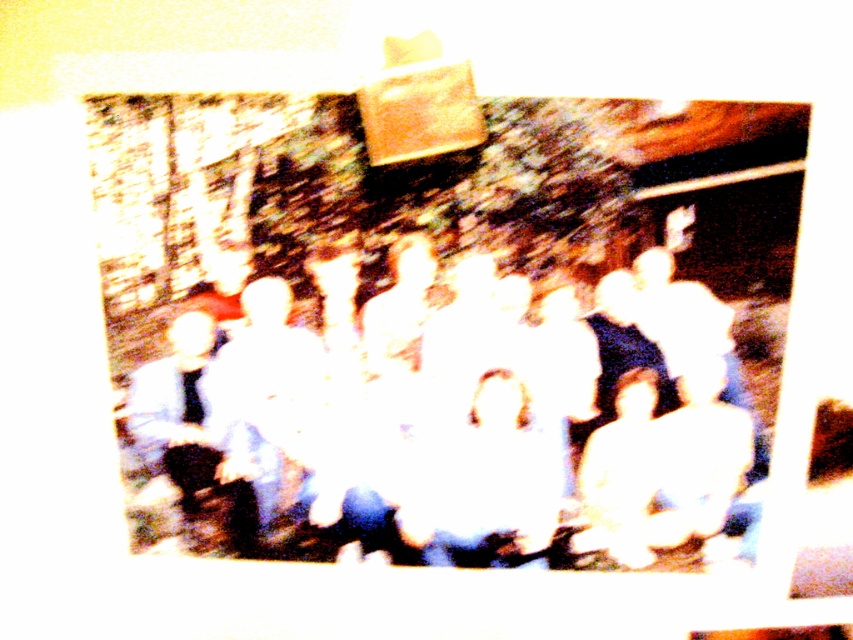
You are holding a camera and want to take a clearer photo of the white cotton shirt at center. Considering the current distance between you and the shirt, is it advisable to move closer or farther away to improve the clarity of the photo?

The white cotton shirt at center and camera are 4.39 feet apart. To improve clarity, you should move closer to the white cotton shirt at center since the current distance may be too far for optimal focus, especially given the overexposed conditions.

You are standing at the center of the image and want to locate the white cotton shirt at center. According to the coordinates provided, in which direction should you look to find it?

The white cotton shirt at center is located at coordinates point (462, 426), which means you should look slightly to the right and down from the very center of the image to find it.

You are organizing a charity event and need to display two shirts as examples. The white cotton shirt at center and the white matte shirt at left are available. Which shirt should you choose if you want the one that is bigger in size?

The white cotton shirt at center is larger in size than the white matte shirt at left, so you should choose the white cotton shirt at center.